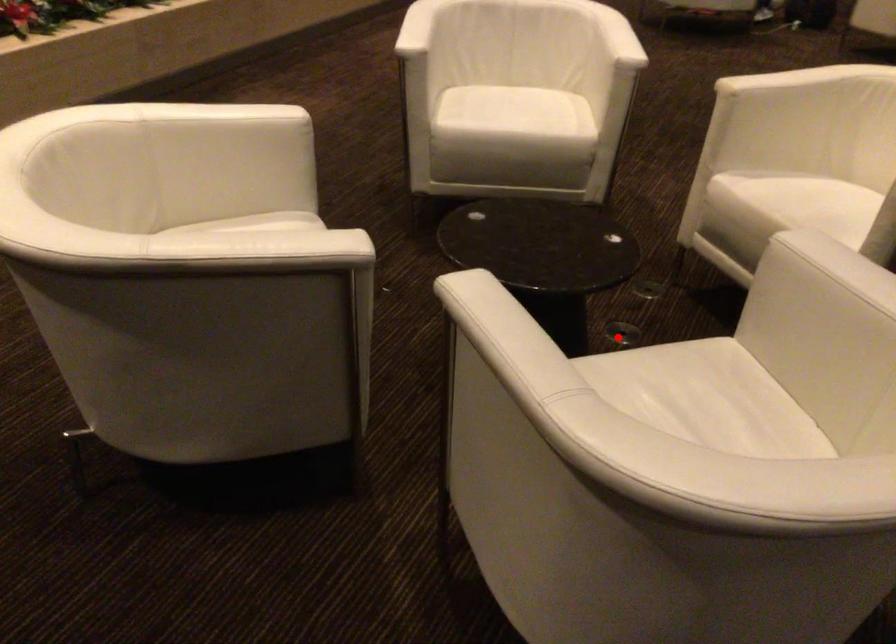
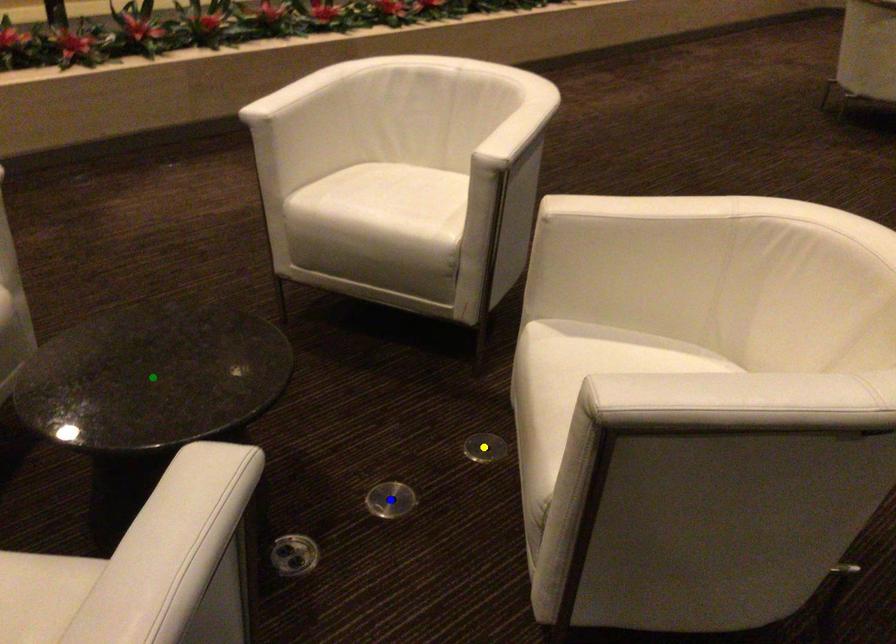
Question: I am providing you with two images of the same scene from different viewpoints. A red point is marked on the first image. You are given multiple points on the second image. In image 2, which mark is for the same physical point as the one in image 1?

Choices:
 (A) blue point
 (B) yellow point
 (C) green point

Answer: (A)